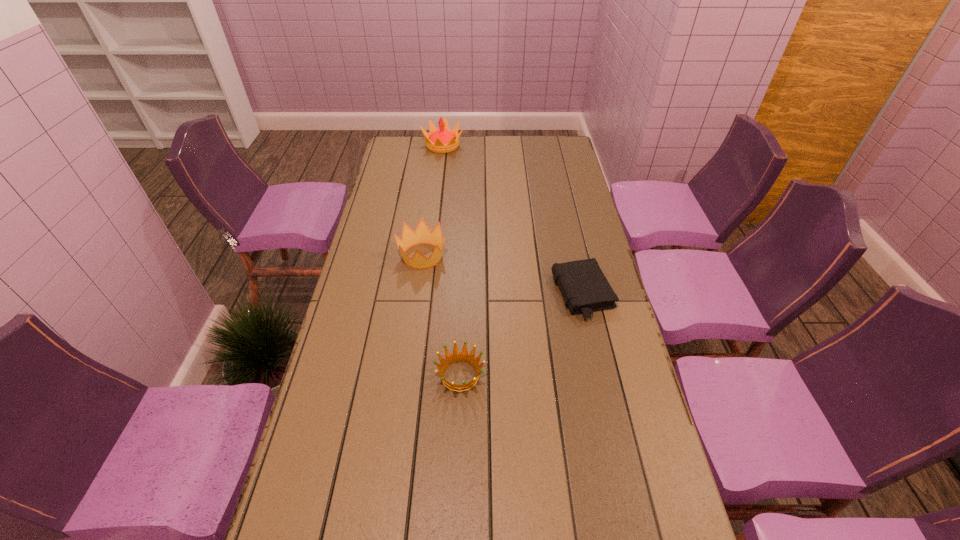
Point out which object is positioned as the nearest to the rightmost object. Please provide its 2D coordinates. Your answer should be formatted as a tuple, i.e. [(x, y)], where the tuple contains the x and y coordinates of a point satisfying the conditions above.

[(456, 357)]

You are a GUI agent. You are given a task and a screenshot of the screen. Output one action in this format:
    pyautogui.click(x=<x>, y=<y>)
    Task: Click on the crown that is the closest to the second nearest crown
    
    Given the screenshot: What is the action you would take?
    [456, 357]

Where is `crown identified as the second closest to the farthest object`? The height and width of the screenshot is (540, 960). crown identified as the second closest to the farthest object is located at coordinates (456, 357).

The height and width of the screenshot is (540, 960). I want to click on vacant region that satisfies the following two spatial constraints: 1. on the front side of the second tallest object; 2. on the left side of the shortest crown, so click(406, 375).

Where is `vacant space that satisfies the following two spatial constraints: 1. on the back side of the shortest crown; 2. on the right side of the shortest object`? vacant space that satisfies the following two spatial constraints: 1. on the back side of the shortest crown; 2. on the right side of the shortest object is located at coordinates (463, 294).